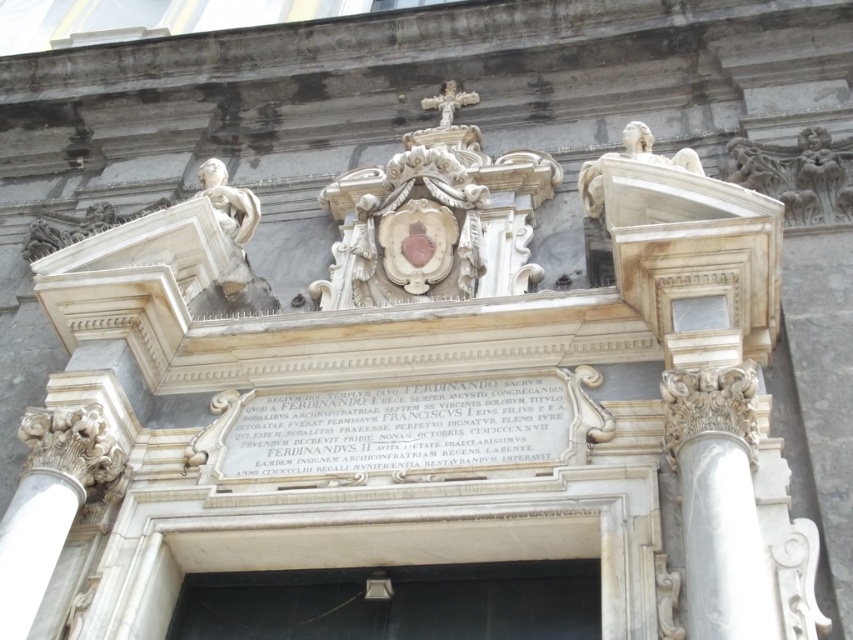
You are an architect inspecting the facade of a historical building. You notice the white marble plaque at center and the white marble column at right. Based on their positions, which object is closer to the left side of the facade?

The white marble plaque at center is to the left of the white marble column at right, so it is closer to the left side of the facade.

You are a painter who needs to decide whether to bring a 3ft wide canvas to paint the black matte door at center and the white marble column at right. Based on the scene, can you determine if the canvas will fit the width of the door?

The black matte door at center might be wider than white marble column at right. Since the canvas is 3ft wide, it may fit the door if it is wider, but the column might be narrower. However, without exact measurements, it is uncertain.

You are an architect designing a replica of this facade. You need to ensure that the white marble plaque at center and the white marble column at right are proportionate. Based on the original, which object should be wider?

The white marble plaque at center might be wider than white marble column at right according to the original design.